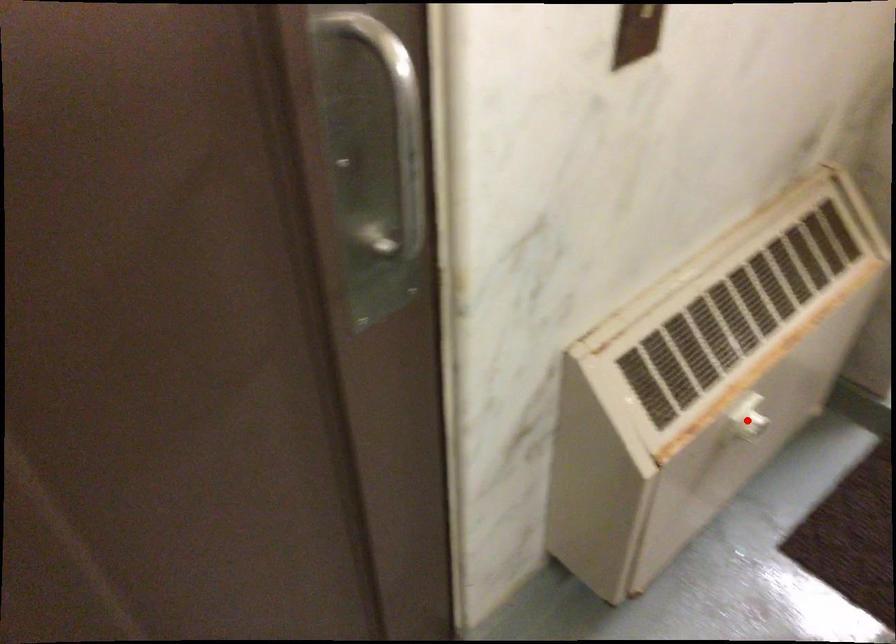
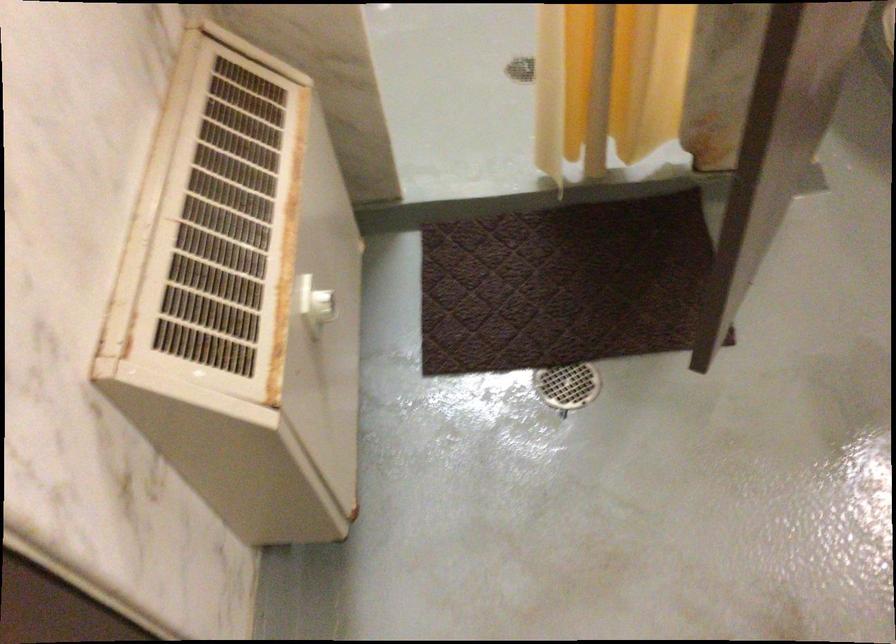
In the second image, find the point that corresponds to the highlighted location in the first image.

(323, 306)